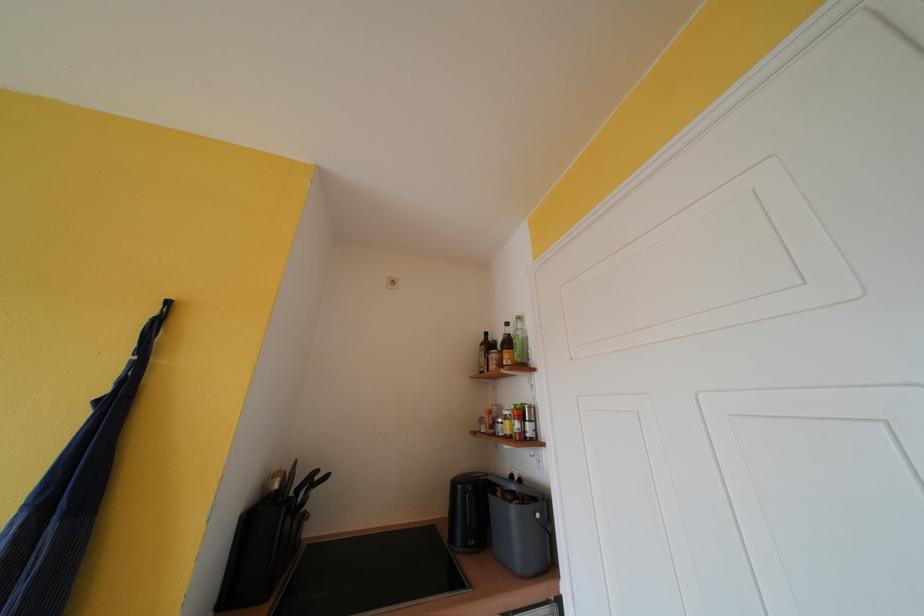
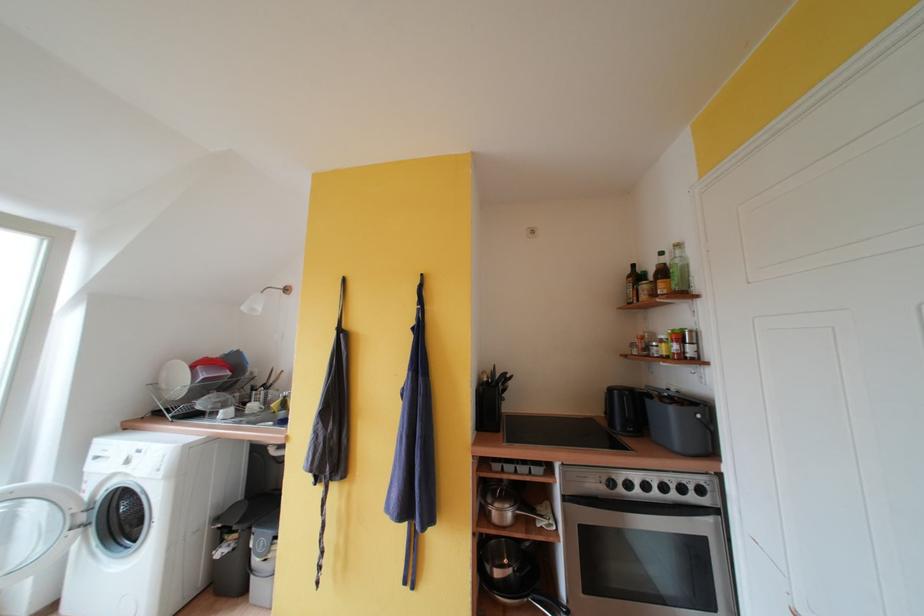
Locate, in the second image, the point that corresponds to (175,306) in the first image.

(428, 278)